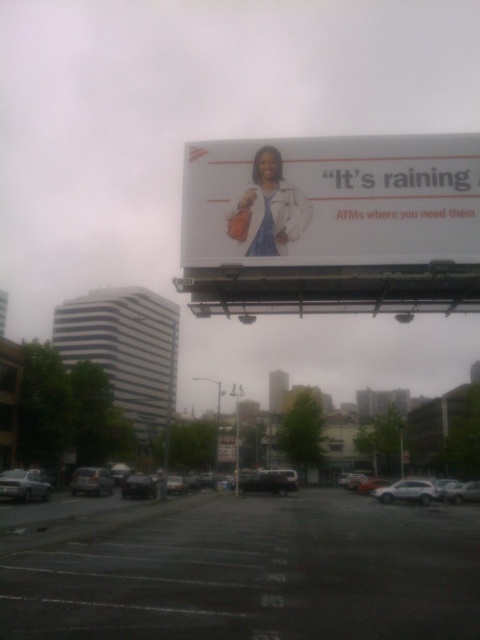
Is white paper billboard at upper center below white matte car at lower right?

Incorrect, white paper billboard at upper center is not positioned below white matte car at lower right.

Who is higher up, white paper billboard at upper center or white matte car at lower right?

white paper billboard at upper center

Locate an element on the screen. This screenshot has width=480, height=640. white paper billboard at upper center is located at coordinates (332, 200).

Can you confirm if shiny black sedan at center is positioned below metallic silver sedan at lower left?

Yes.

Does shiny black sedan at center have a larger size compared to metallic silver sedan at lower left?

Indeed, shiny black sedan at center has a larger size compared to metallic silver sedan at lower left.

Find the location of a particular element. shiny black sedan at center is located at coordinates coord(266,483).

Does white matte car at lower right have a greater height compared to metallic silver sedan at lower left?

Indeed, white matte car at lower right has a greater height compared to metallic silver sedan at lower left.

At what (x,y) coordinates should I click in order to perform the action: click on white matte car at lower right. Please return your answer as a coordinate pair (x, y). This screenshot has height=640, width=480. Looking at the image, I should click on click(x=407, y=492).

Is point (433, 493) positioned behind point (103, 490)?

Yes, it is.

In order to click on white matte car at lower right in this screenshot , I will do `click(407, 492)`.